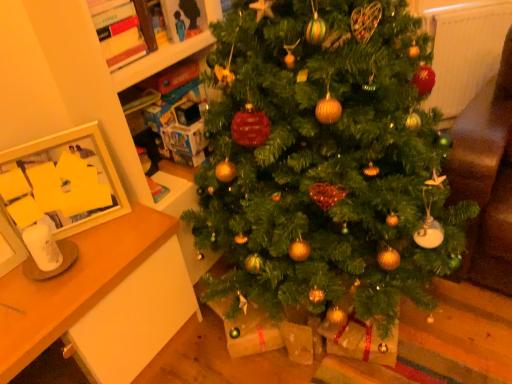
This screenshot has width=512, height=384. I want to click on free space on the front side of white glossy picture frame at left, so click(84, 274).